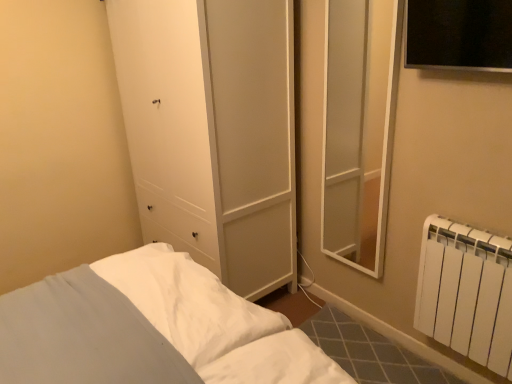
Find the location of a particular element. The height and width of the screenshot is (384, 512). blank space above white matte radiator at lower right (from a real-world perspective) is located at coordinates (476, 231).